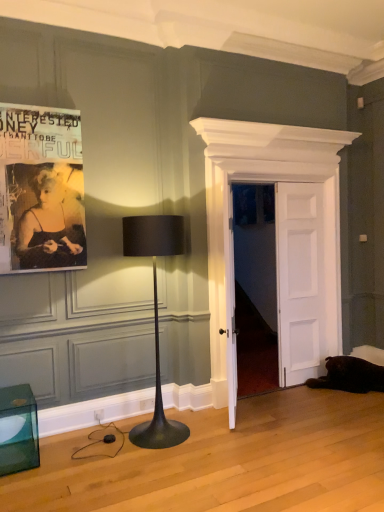
You are a GUI agent. You are given a task and a screenshot of the screen. Output one action in this format:
    pyautogui.click(x=<x>, y=<y>)
    Task: Click on the vacant area that lies in front of matte black lamp at center-left
    This screenshot has height=512, width=384.
    Given the screenshot: What is the action you would take?
    pyautogui.click(x=153, y=465)